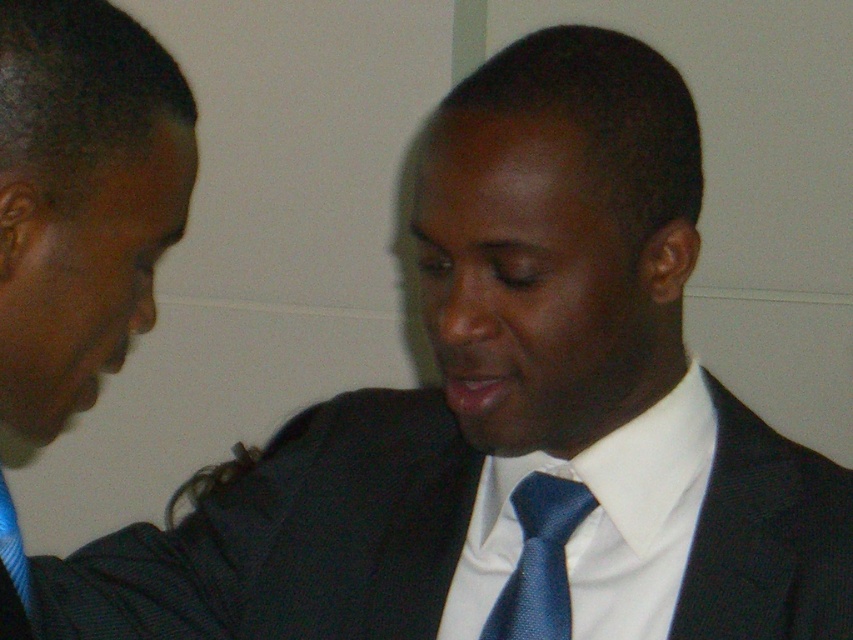
Can you confirm if matte black suit at center is bigger than matte black suit at left?

Yes, matte black suit at center is bigger than matte black suit at left.

Which of these two, matte black suit at center or matte black suit at left, stands taller?

With more height is matte black suit at left.

Which is in front, point (733, 444) or point (108, 6)?

Point (108, 6)

Image resolution: width=853 pixels, height=640 pixels. I want to click on matte black suit at center, so click(289, 538).

Which is behind, point (300, 595) or point (639, 504)?

Point (300, 595)

Is matte black suit at center in front of white satin dress shirt at center?

That is True.

Where is `matte black suit at center`? The height and width of the screenshot is (640, 853). matte black suit at center is located at coordinates pyautogui.click(x=289, y=538).

What are the coordinates of `matte black suit at center` in the screenshot? It's located at (289, 538).

Does matte black suit at left appear on the left side of white satin dress shirt at center?

Yes, matte black suit at left is to the left of white satin dress shirt at center.

Can you confirm if matte black suit at left is positioned above white satin dress shirt at center?

Yes.

Who is more forward, (27, 106) or (689, 376)?

Point (27, 106)

Locate an element on the screen. matte black suit at left is located at coordinates point(80,198).